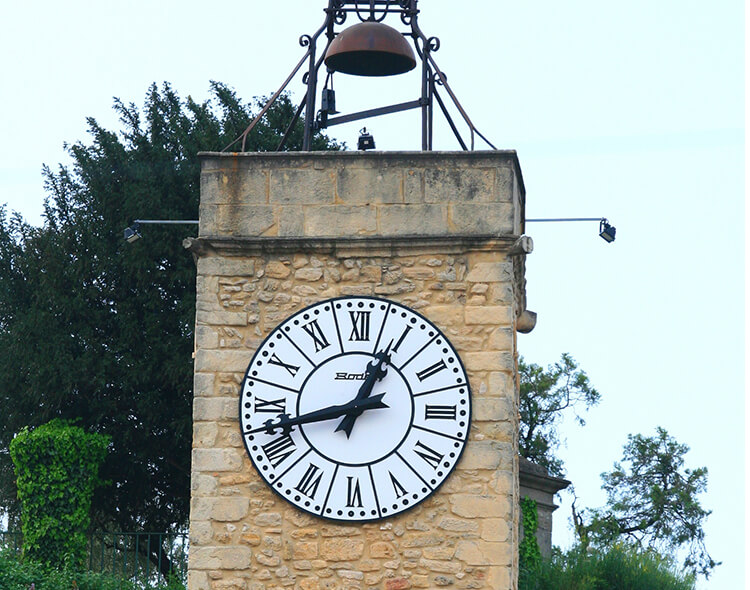
Locate an element on the screen. The height and width of the screenshot is (590, 750). side lights is located at coordinates (606, 236), (136, 237).